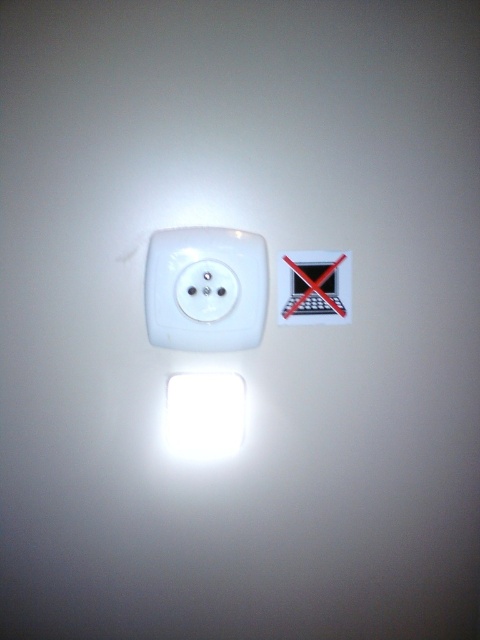
Question: Which of the following is the closest to the observer?

Choices:
 (A) (148, 280)
 (B) (212, 378)
 (C) (309, 291)

Answer: (A)

Question: Is white glossy light at center bigger than white plastic light switch at center?

Choices:
 (A) no
 (B) yes

Answer: (B)

Question: Is white glossy electric outlet at center to the left of white glossy light at center from the viewer's perspective?

Choices:
 (A) no
 (B) yes

Answer: (A)

Question: Which of the following is the farthest from the observer?

Choices:
 (A) white glossy electric outlet at center
 (B) white plastic light switch at center
 (C) white glossy light at center

Answer: (B)

Question: Is white glossy electric outlet at center thinner than white plastic light switch at center?

Choices:
 (A) no
 (B) yes

Answer: (A)

Question: Which object appears closest to the camera in this image?

Choices:
 (A) white plastic light switch at center
 (B) white glossy light at center
 (C) white glossy electric outlet at center

Answer: (C)